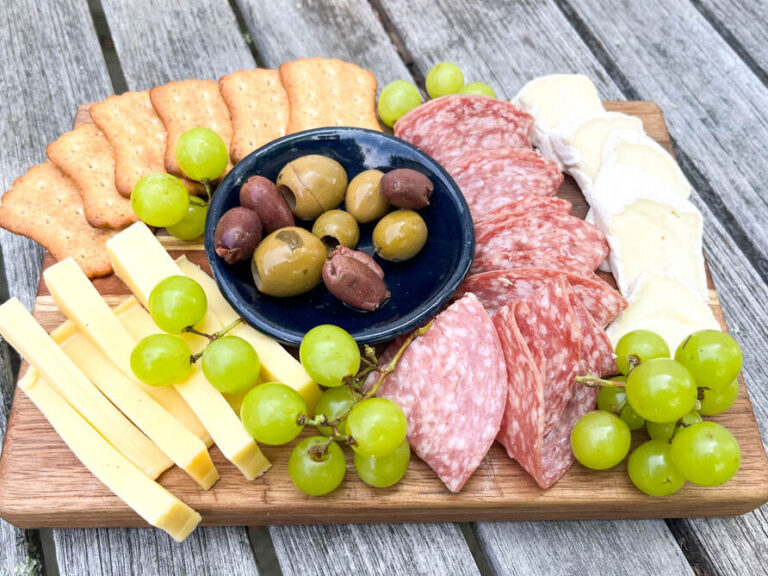
This screenshot has width=768, height=576. Find the location of `wooden board`. wooden board is located at coordinates (517, 505).